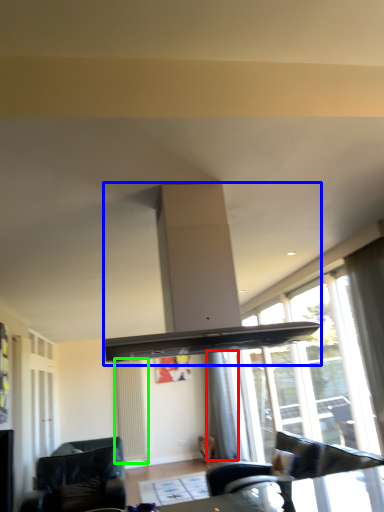
Question: Based on their relative distances, which object is farther from curtain (highlighted by a red box)? Choose from exhaust hood (highlighted by a blue box) and radiator (highlighted by a green box).

Choices:
 (A) exhaust hood
 (B) radiator

Answer: (A)